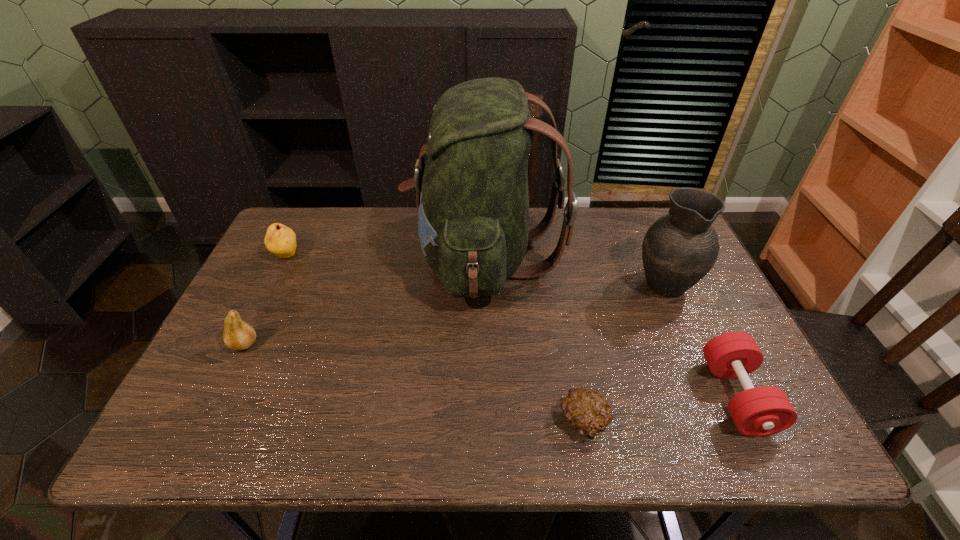
I want to click on backpack, so click(472, 195).

Image resolution: width=960 pixels, height=540 pixels. I want to click on the fifth shortest object, so click(x=679, y=249).

Locate an element on the screen. the third nearest object is located at coordinates (238, 335).

At what (x,y) coordinates should I click in order to perform the action: click on the farther pear. Please return your answer as a coordinate pair (x, y). Image resolution: width=960 pixels, height=540 pixels. Looking at the image, I should click on (281, 240).

The height and width of the screenshot is (540, 960). Identify the location of dumbbell. (761, 411).

Locate an element on the screen. The image size is (960, 540). muffin is located at coordinates (587, 411).

Identify the location of vacant area situated 0.210m on the open flap of the backpack. The width and height of the screenshot is (960, 540). (338, 258).

I want to click on vacant space located on the open flap of the backpack, so click(328, 258).

Identify the location of vacant space located 0.090m on the open flap of the backpack. Image resolution: width=960 pixels, height=540 pixels. (378, 258).

The height and width of the screenshot is (540, 960). Find the location of `blank space located 0.270m on the side of the pitcher with the handle`. blank space located 0.270m on the side of the pitcher with the handle is located at coordinates (632, 208).